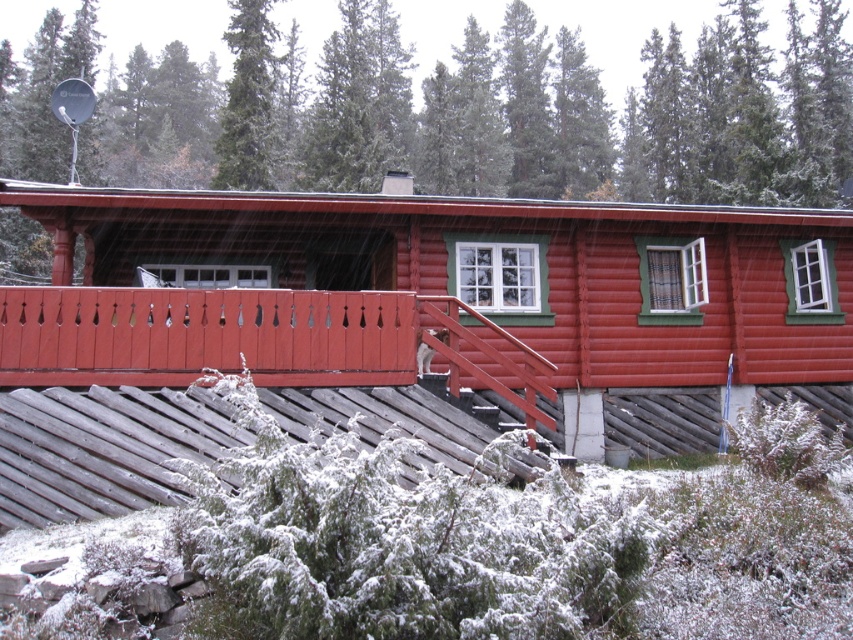
You are standing at the base of the slope in front of the cabin and want to take a photo of both the matte wooden cabin at center and the green coniferous tree at upper center. Which object should you position closer to the camera to ensure both are in the frame?

You should position the matte wooden cabin at center closer to the camera because it is below the green coniferous tree at upper center, so moving closer to the cabin will keep both in the frame without one blocking the other.

You are standing in front of the cabin and want to take a photo of both the matte wooden cabin at center and the green coniferous tree at upper center. Which object should you position to your left to include both in the frame?

The matte wooden cabin at center is positioned on the left side of the green coniferous tree at upper center. To include both in the frame, position the green coniferous tree at upper center to your left so that the matte wooden cabin at center will naturally be on the right side of the tree in the photo.

You are standing at the base of the slope leading to the matte wooden cabin at center. If you walk straight towards it, how far will you have to walk to reach the cabin?

The matte wooden cabin at center is 8.86 meters away from the viewer, so you will have to walk 8.86 meters to reach it.